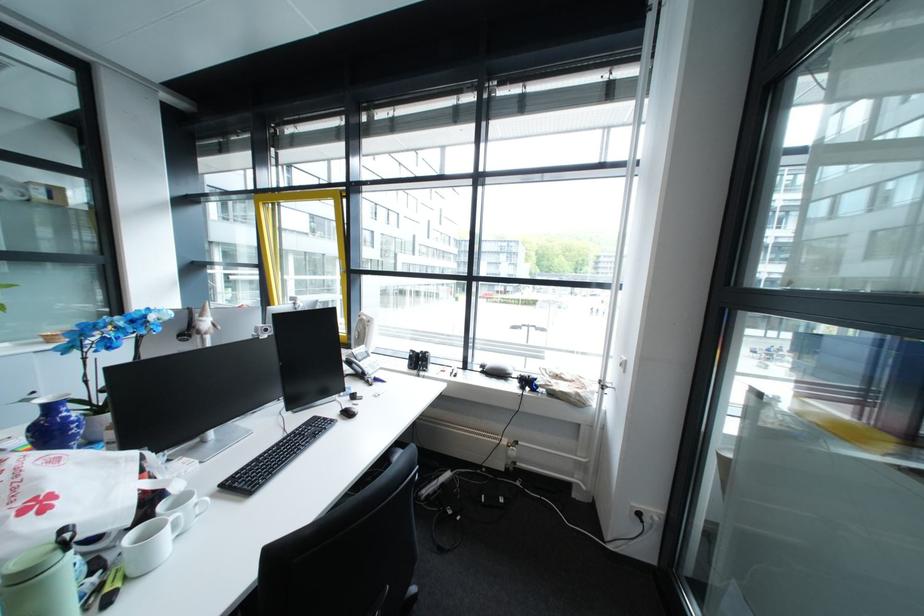
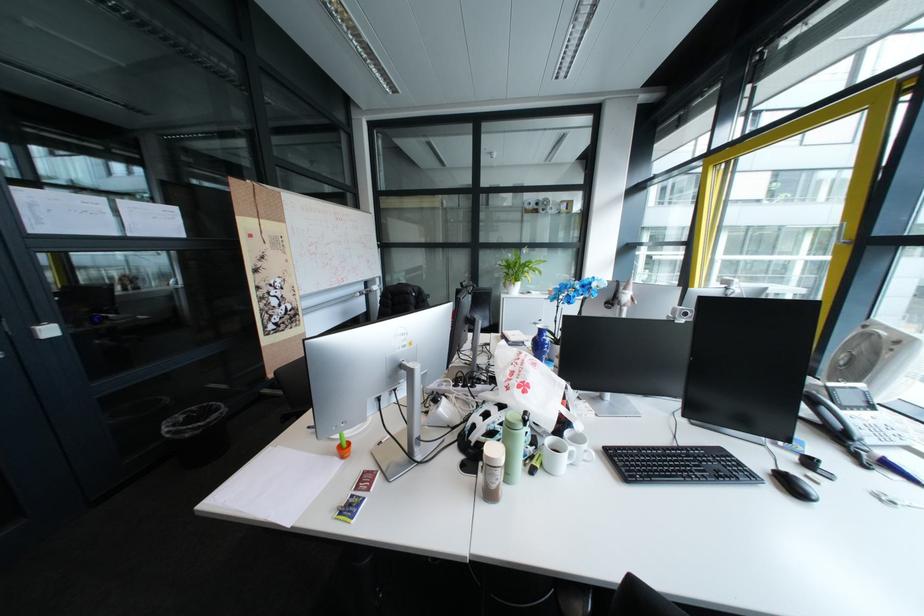
Where in the second image is the point corresponding to (313,428) from the first image?

(710, 448)